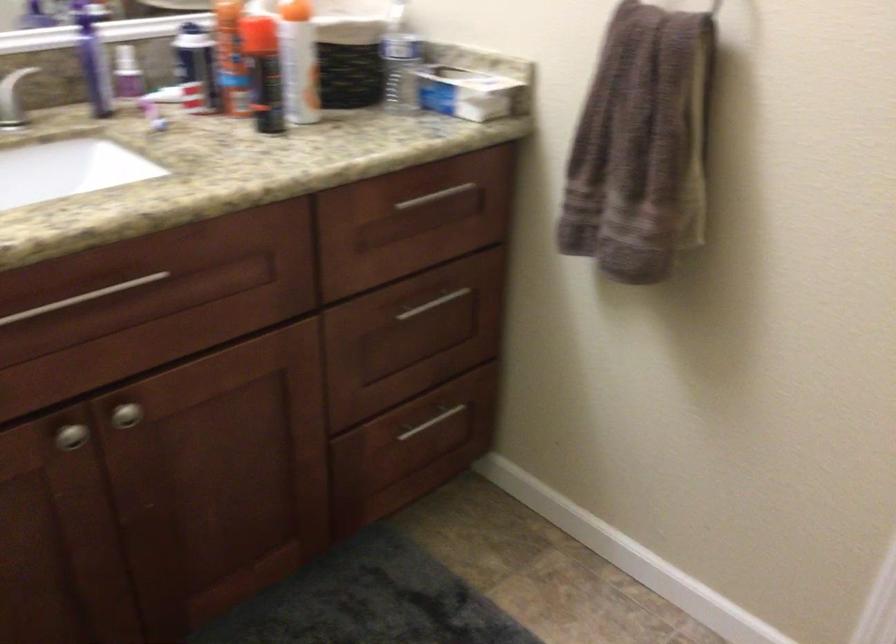
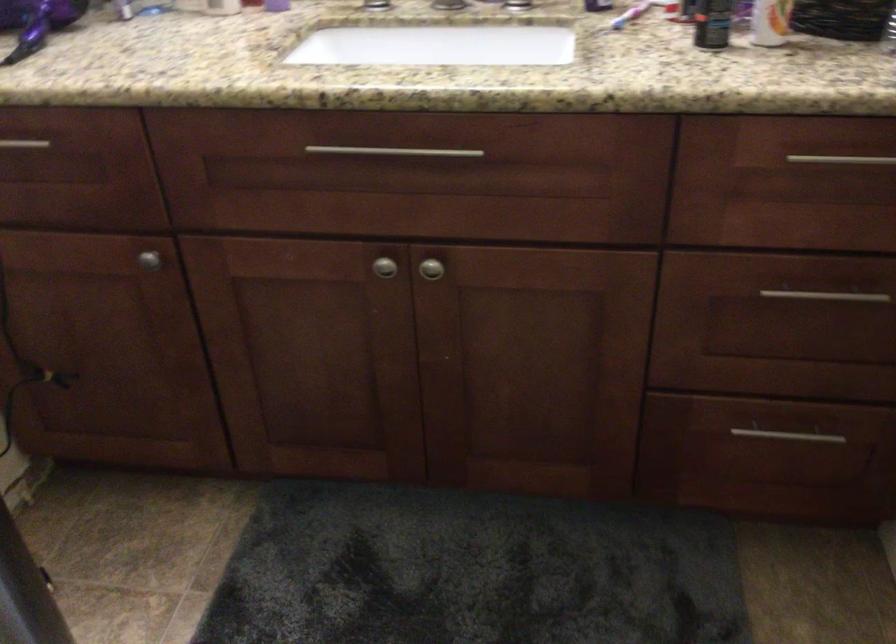
Where in the second image is the point corresponding to pixel 70 436 from the first image?

(383, 267)